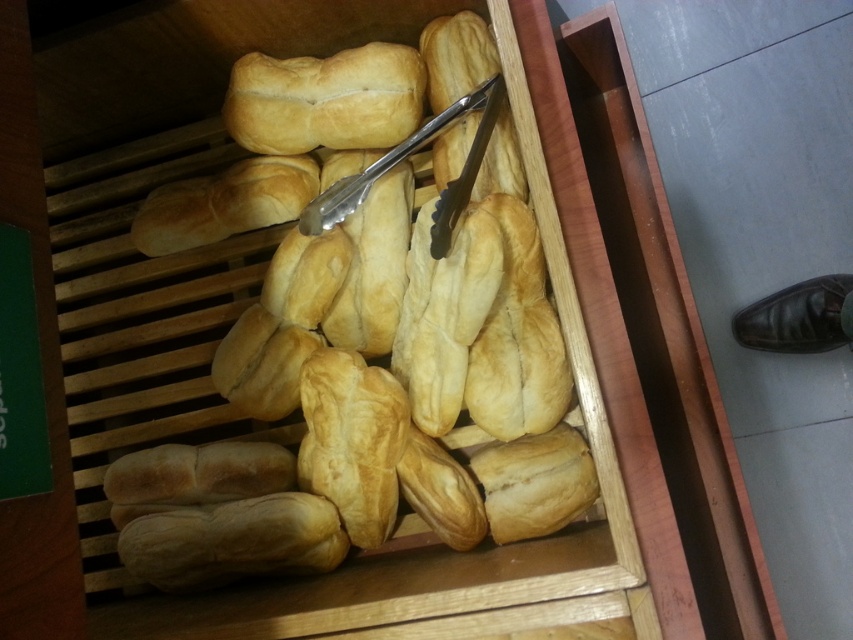
Question: Which of the following is the closest to the observer?

Choices:
 (A) golden-brown crusty bread at center
 (B) golden brown crusty loaf at center
 (C) silver metallic tong at center

Answer: (C)

Question: Can you confirm if golden brown crusty loaf at center is thinner than silver metallic tong at center?

Choices:
 (A) yes
 (B) no

Answer: (B)

Question: Which of these objects is positioned farthest from the golden brown crusty loaf at center?

Choices:
 (A) golden-brown crusty bread at center
 (B) silver metallic tong at center

Answer: (A)

Question: Which point is farther to the camera?

Choices:
 (A) (323, 216)
 (B) (369, 51)

Answer: (B)

Question: Does golden-brown crusty bread at center appear under golden brown crusty loaf at center?

Choices:
 (A) no
 (B) yes

Answer: (B)

Question: Is golden brown crusty loaf at center below silver metallic tong at center?

Choices:
 (A) no
 (B) yes

Answer: (A)